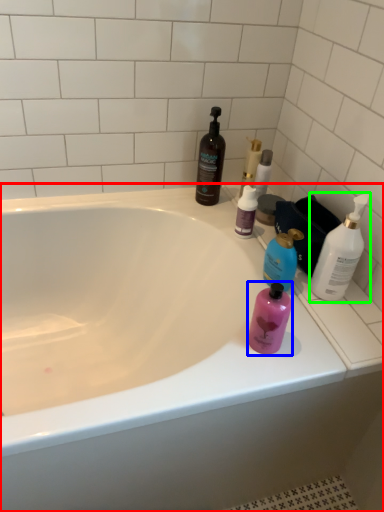
Question: Considering the real-world distances, which object is farthest from bathtub (highlighted by a red box)? bottle (highlighted by a blue box) or bottle (highlighted by a green box)?

Choices:
 (A) bottle
 (B) bottle

Answer: (B)